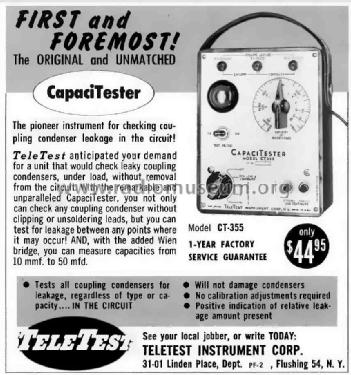
Where is `handle`? The image size is (351, 375). handle is located at coordinates (228, 23).